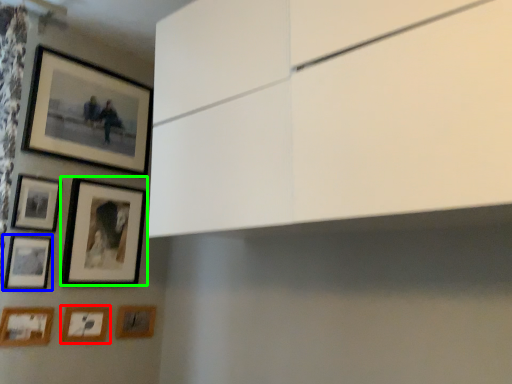
Question: Which is nearer to the picture frame (highlighted by a red box)? picture frame (highlighted by a blue box) or picture frame (highlighted by a green box).

Choices:
 (A) picture frame
 (B) picture frame

Answer: (A)